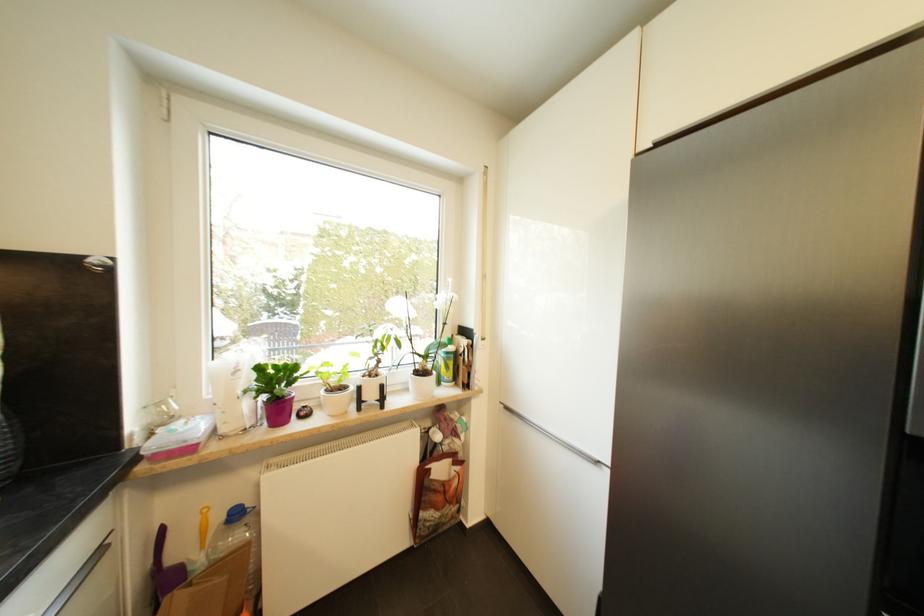
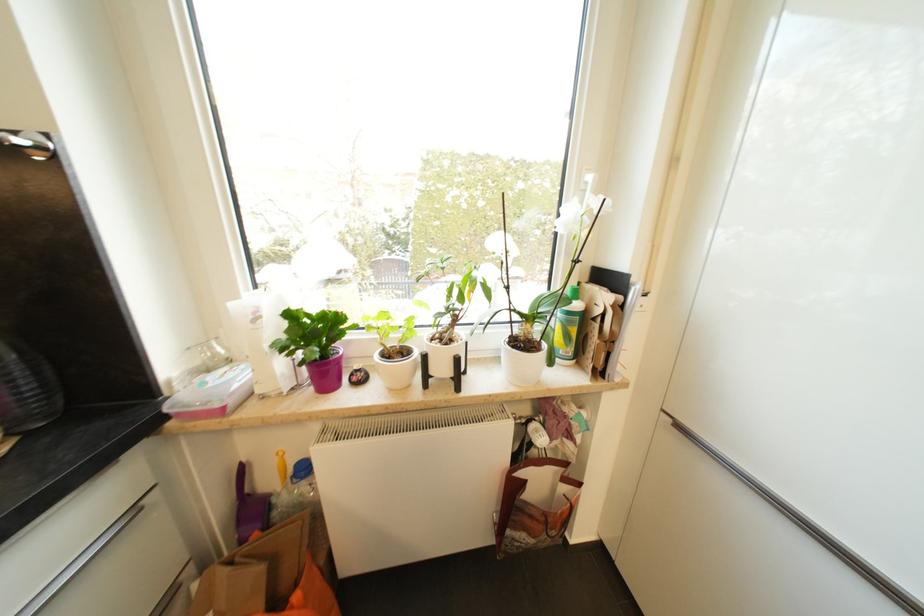
Find the pixel in the second image that matches point 224,522 in the first image.

(295, 471)